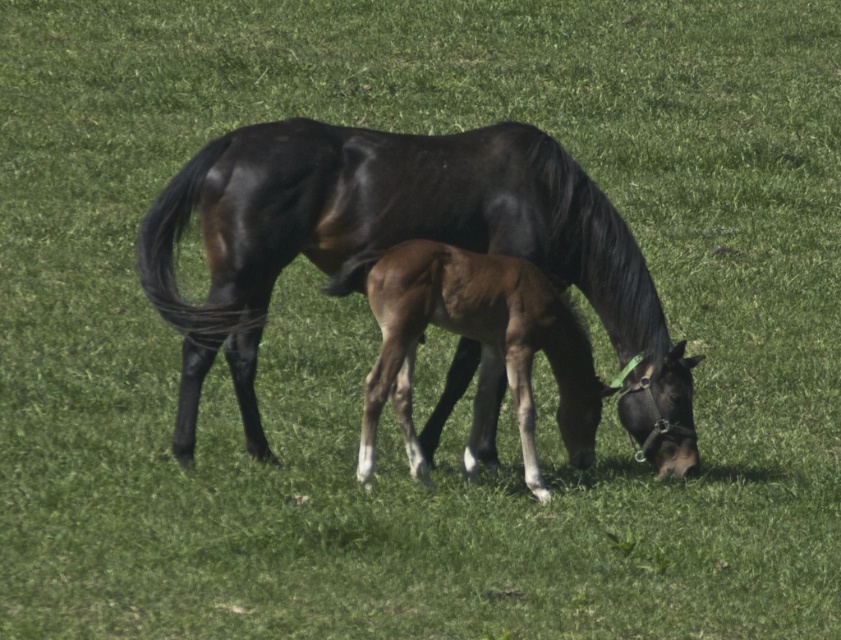
Question: Is shiny black horse at center thinner than brown glossy foal at center?

Choices:
 (A) yes
 (B) no

Answer: (B)

Question: Is shiny black horse at center bigger than brown glossy foal at center?

Choices:
 (A) yes
 (B) no

Answer: (A)

Question: Which object is closer to the camera taking this photo?

Choices:
 (A) brown glossy foal at center
 (B) shiny black horse at center

Answer: (A)

Question: Is shiny black horse at center wider than brown glossy foal at center?

Choices:
 (A) no
 (B) yes

Answer: (B)